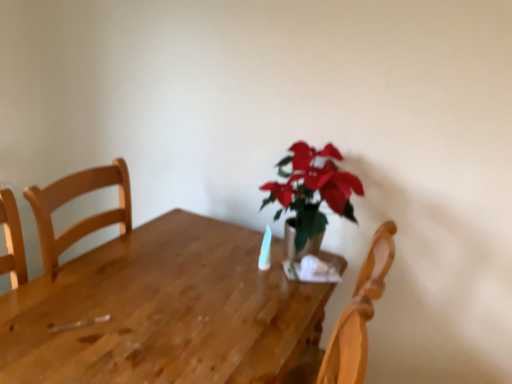
The height and width of the screenshot is (384, 512). In order to click on wooden table at center in this screenshot , I will do `click(161, 311)`.

Describe the element at coordinates (161, 311) in the screenshot. I see `wooden table at center` at that location.

At what (x,y) coordinates should I click in order to perform the action: click on wooden table at center. Please return your answer as a coordinate pair (x, y). Image resolution: width=512 pixels, height=384 pixels. Looking at the image, I should click on coord(161,311).